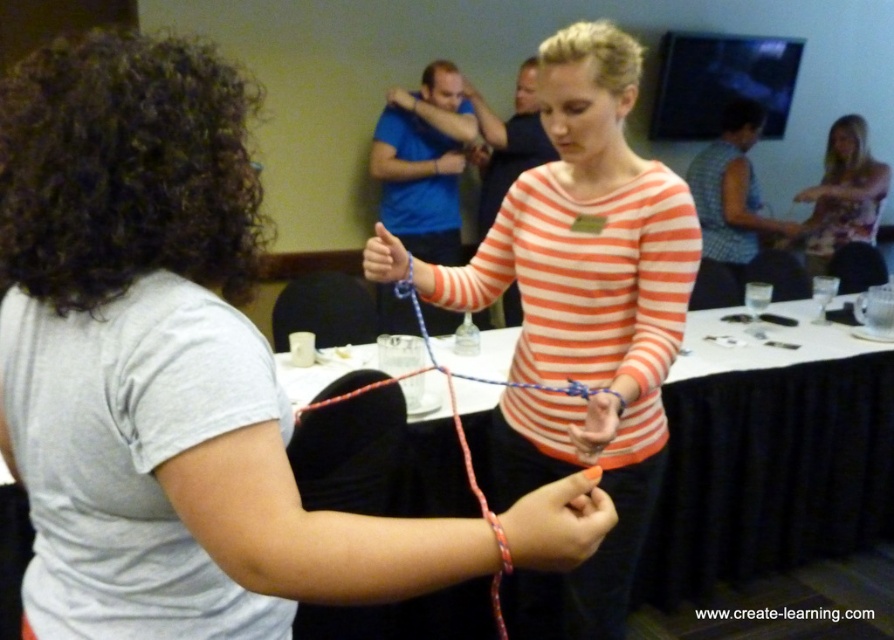
Between matte plastic table at center and floral fabric shirt at upper right, which one is positioned higher?

floral fabric shirt at upper right

Image resolution: width=894 pixels, height=640 pixels. I want to click on matte plastic table at center, so click(769, 454).

Between orange striped shirt at center and matte orange striped shirt at center, which one has less height?

orange striped shirt at center is shorter.

The image size is (894, 640). I want to click on orange striped shirt at center, so click(180, 372).

Does matte orange striped shirt at center come in front of floral fabric shirt at upper right?

Yes, it is in front of floral fabric shirt at upper right.

Is matte orange striped shirt at center bigger than floral fabric shirt at upper right?

Yes, matte orange striped shirt at center is bigger than floral fabric shirt at upper right.

Where is `matte orange striped shirt at center`? Image resolution: width=894 pixels, height=640 pixels. matte orange striped shirt at center is located at coordinates (579, 317).